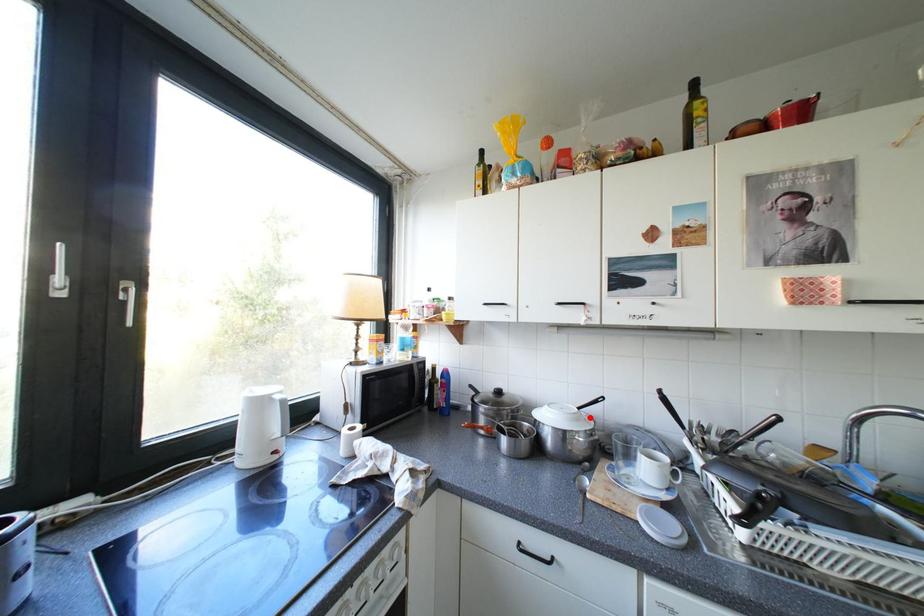
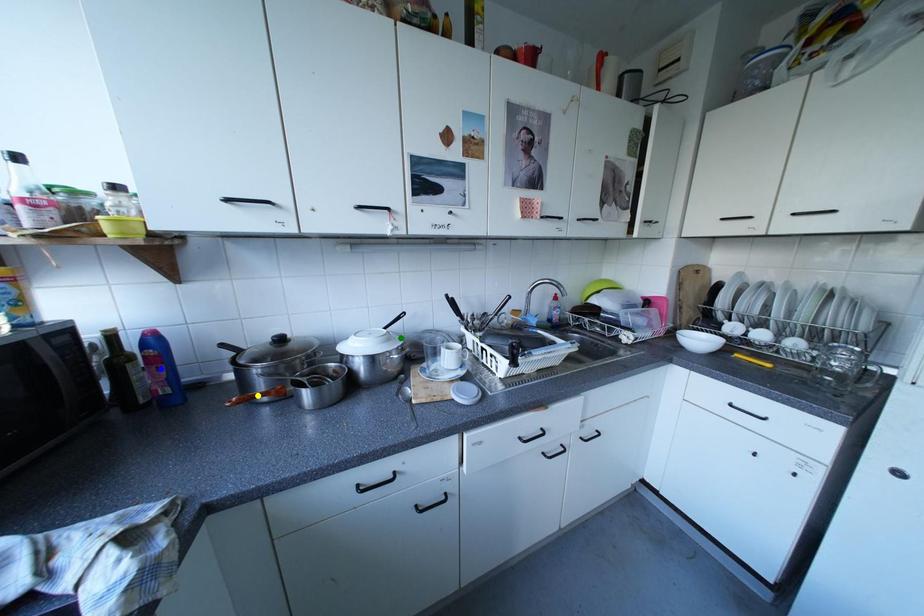
Question: I am providing you with two images of the same scene from different viewpoints. A red point is marked on the first image. You are given multiple points on the second image. Which mark in image 2 goes with the point in image 1?

Choices:
 (A) blue point
 (B) yellow point
 (C) green point

Answer: (C)